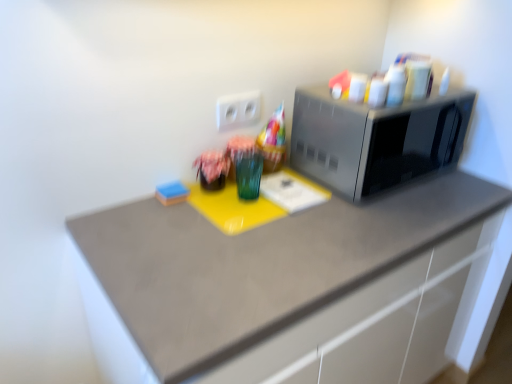
Find the location of a particular element. free spot in front of blue sponge at lower left is located at coordinates (165, 224).